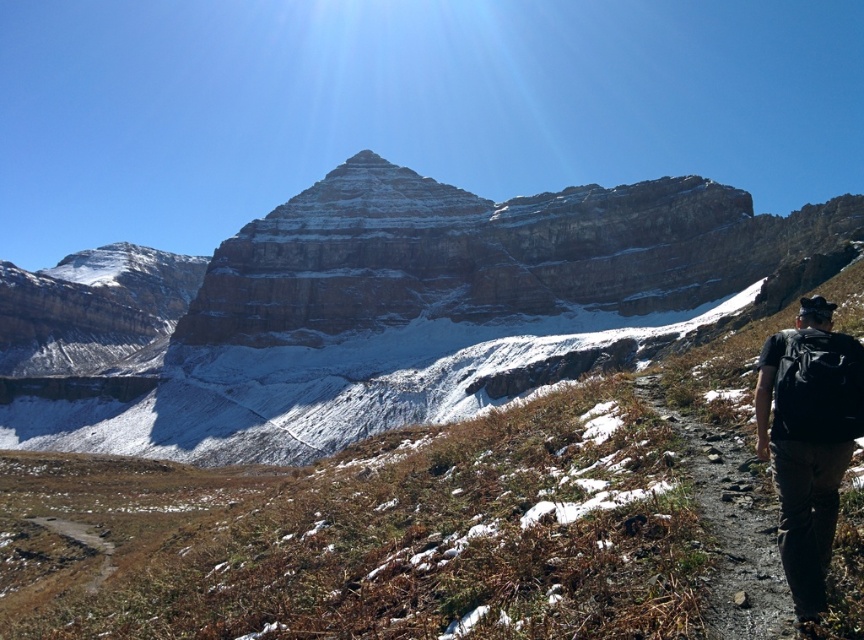
You are a hiker standing at point A, which is located at coordinates (399, 310). Looking around, you see a rugged stone mountain at center. What is the closest major landmark to your current position?

The closest major landmark to point A at coordinates (399, 310) is the rugged stone mountain at center, as it is located at that exact point.

You are a hiker planning to take the dirt path at lower right to reach the rugged stone mountain at center. Based on the scene, will you need to climb upwards to reach the mountain from the path?

The rugged stone mountain at center has a greater height compared to dirt path at lower right, so yes, you will need to climb upwards to reach the mountain from the dirt path at lower right.